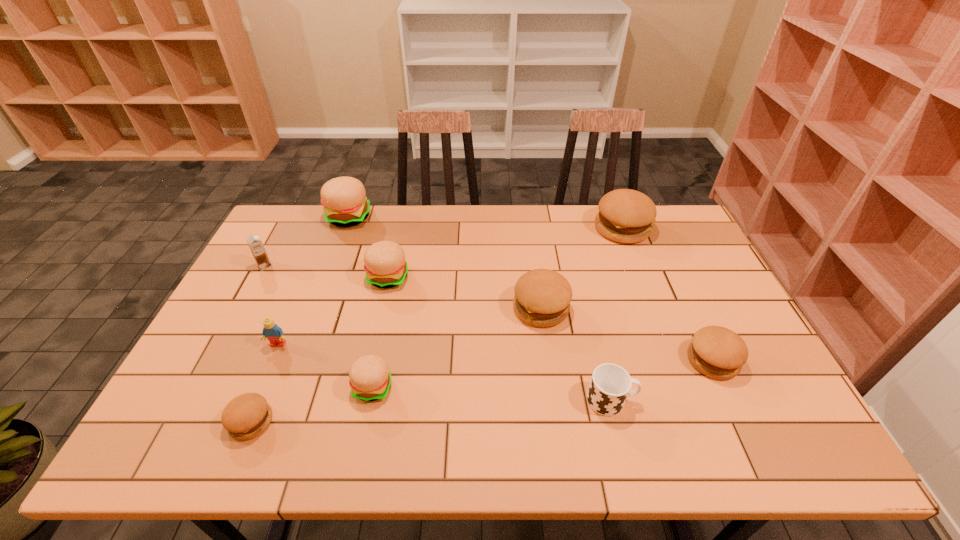
The height and width of the screenshot is (540, 960). I want to click on the leftmost beige hamburger, so click(x=344, y=199).

You are a GUI agent. You are given a task and a screenshot of the screen. Output one action in this format:
    pyautogui.click(x=<x>, y=<y>)
    Task: Click on the farthest beige hamburger
    The image size is (960, 540).
    Given the screenshot: What is the action you would take?
    pyautogui.click(x=344, y=199)

Where is `the biggest brown hamburger`? the biggest brown hamburger is located at coordinates [626, 216].

The height and width of the screenshot is (540, 960). Find the location of `the leftmost object`. the leftmost object is located at coordinates (256, 246).

Where is `the second smallest beige hamburger`? This screenshot has width=960, height=540. the second smallest beige hamburger is located at coordinates (384, 262).

Find the location of a particular element. The width and height of the screenshot is (960, 540). the third hamburger from right to left is located at coordinates (542, 298).

You are a GUI agent. You are given a task and a screenshot of the screen. Output one action in this format:
    pyautogui.click(x=<x>, y=<y>)
    Task: Click on the second brown hamburger from left to right
    The image size is (960, 540).
    Given the screenshot: What is the action you would take?
    pyautogui.click(x=542, y=298)

You are a GUI agent. You are given a task and a screenshot of the screen. Output one action in this format:
    pyautogui.click(x=<x>, y=<y>)
    Task: Click on the Lego
    Image resolution: width=960 pixels, height=540 pixels.
    Given the screenshot: What is the action you would take?
    pyautogui.click(x=271, y=331)

Image resolution: width=960 pixels, height=540 pixels. In order to click on the second nearest brown hamburger in this screenshot , I will do `click(717, 352)`.

At what (x,y) coordinates should I click in order to perform the action: click on cup. Please return your answer as a coordinate pair (x, y). This screenshot has width=960, height=540. Looking at the image, I should click on (610, 385).